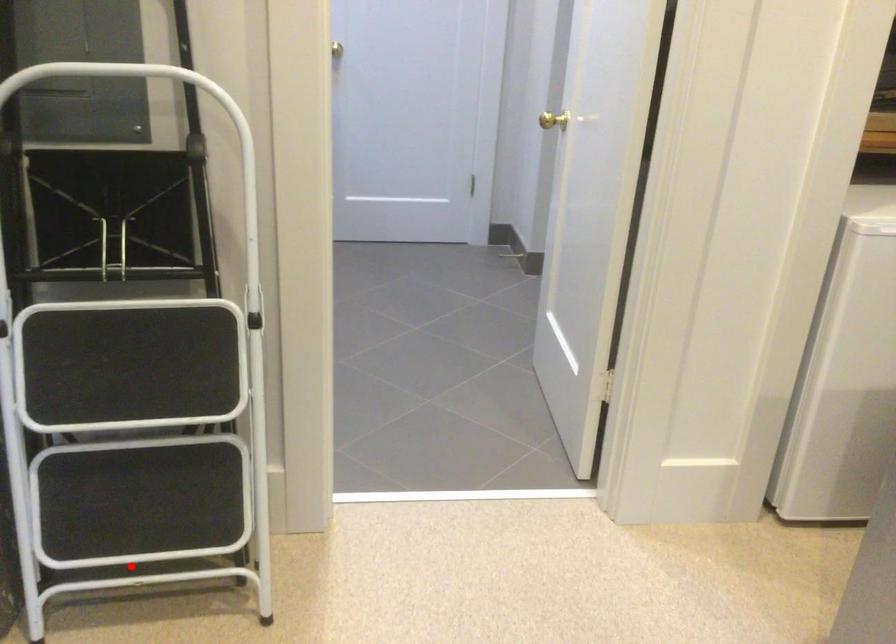
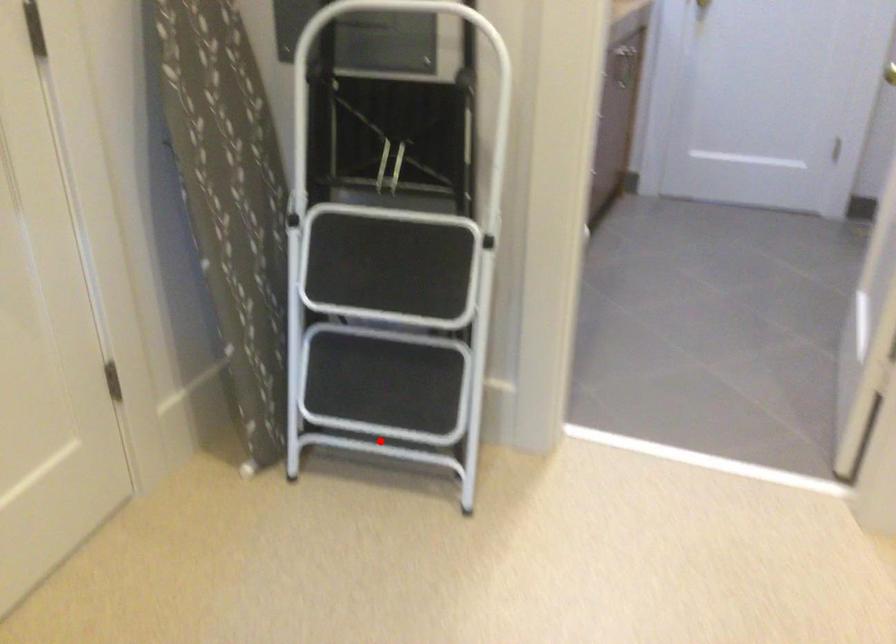
I am providing you with two images of the same scene from different viewpoints. A red point is marked on the first image and another point is marked on the second image. Is the marked point in image1 the same physical position as the marked point in image2?

Yes